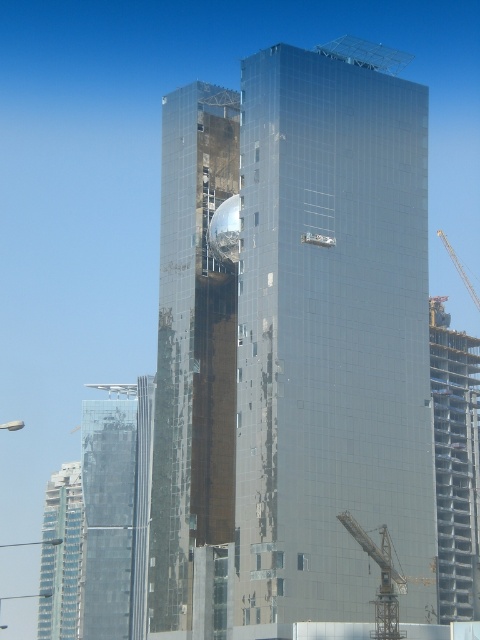
You are an architect reviewing the construction site of a modern skyscraper. You observe the glossy glass building at center and the metallic glass building at right. Which building is positioned to the right side of the other?

The glossy glass building at center is to the left of metallic glass building at right, so the metallic glass building at right is positioned to the right side of the glossy glass building at center.

You are an architect reviewing the construction site of a modern skyscraper. You notice two structures at the center of the image. Which one is closer to you, the glossy glass building at center or the shiny glass tower at center?

The glossy glass building at center is closer to you because it is in front of the shiny glass tower at center.